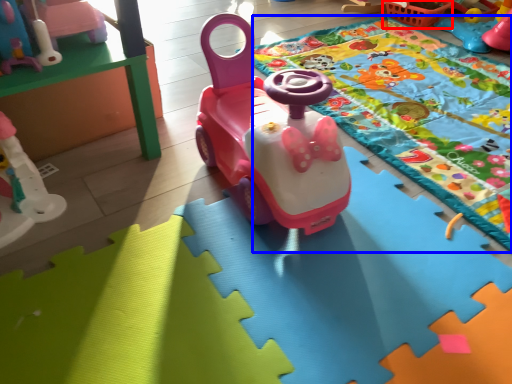
Question: Which of the following is the farthest to the observer, basket (highlighted by a red box) or blanket (highlighted by a blue box)?

Choices:
 (A) basket
 (B) blanket

Answer: (A)